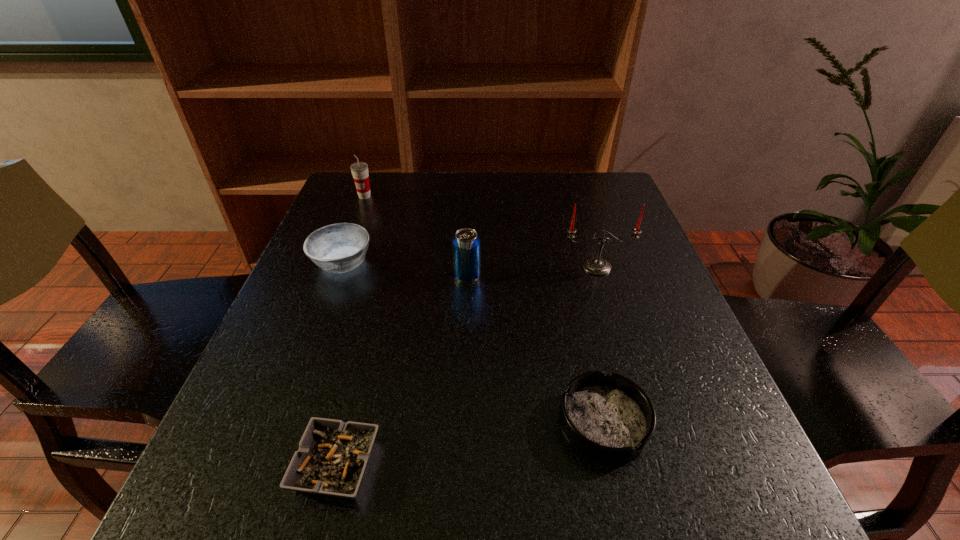
Image resolution: width=960 pixels, height=540 pixels. What are the coordinates of `blank space located 0.330m on the front of the beer can` in the screenshot? It's located at (463, 424).

This screenshot has height=540, width=960. I want to click on vacant region located on the right of the tallest ashtray, so click(x=540, y=263).

I want to click on free location located on the back of the fifth tallest object, so click(582, 328).

Find the location of a particular element. This screenshot has height=540, width=960. vacant region located 0.090m on the back of the shortest ashtray is located at coordinates (357, 381).

Find the location of a particular element. The height and width of the screenshot is (540, 960). object that is at the far edge is located at coordinates (359, 170).

Locate an element on the screen. This screenshot has width=960, height=540. object located at the near edge is located at coordinates (332, 456).

You are a GUI agent. You are given a task and a screenshot of the screen. Output one action in this format:
    pyautogui.click(x=<x>, y=<y>)
    Task: Click on the cup at the left edge
    
    Given the screenshot: What is the action you would take?
    pyautogui.click(x=359, y=170)

Where is `candle present at the right edge`? The height and width of the screenshot is (540, 960). candle present at the right edge is located at coordinates (598, 266).

Where is `ashtray located at the right edge`? The width and height of the screenshot is (960, 540). ashtray located at the right edge is located at coordinates (609, 418).

The width and height of the screenshot is (960, 540). I want to click on object situated at the far left corner, so click(x=359, y=170).